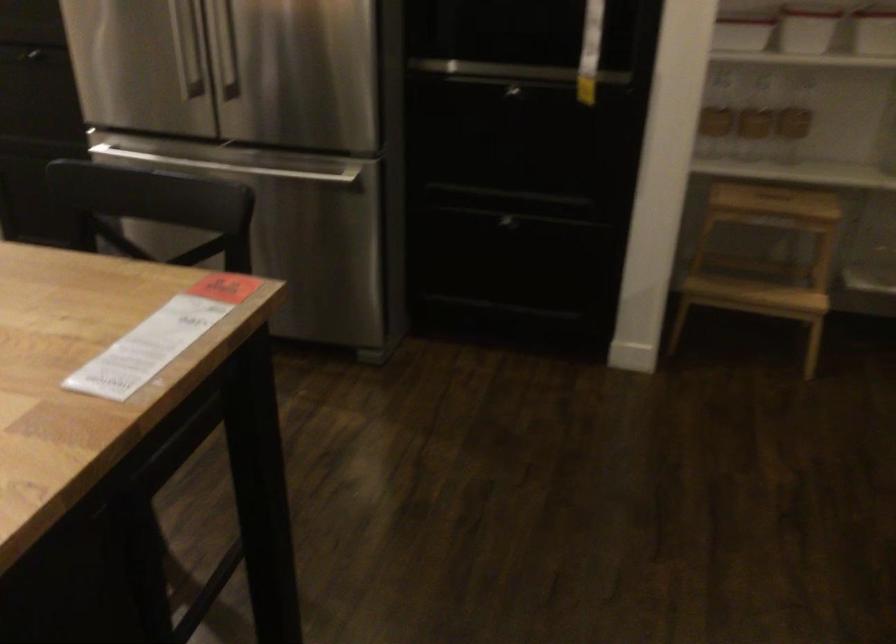
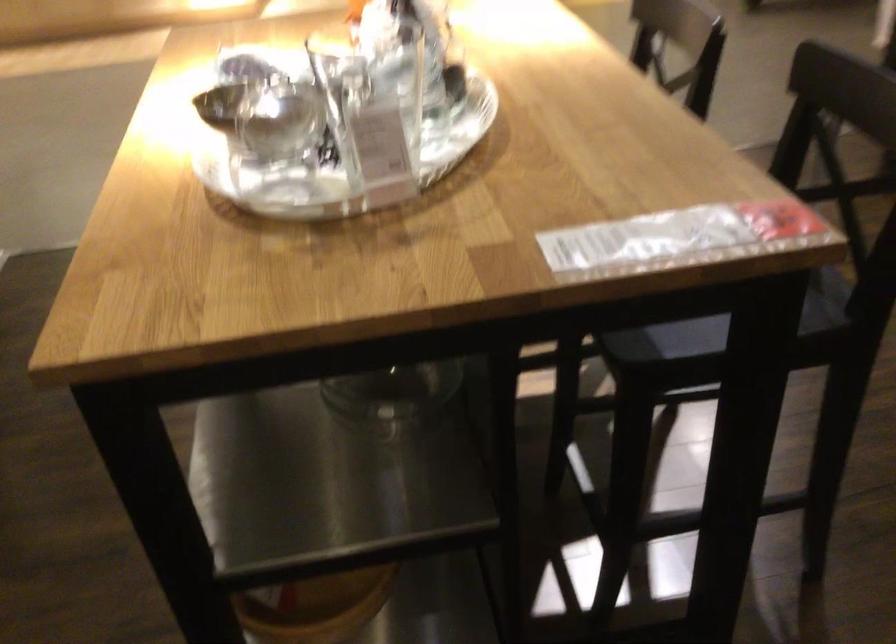
Locate, in the second image, the point that corresponds to (x=185, y=337) in the first image.

(676, 238)